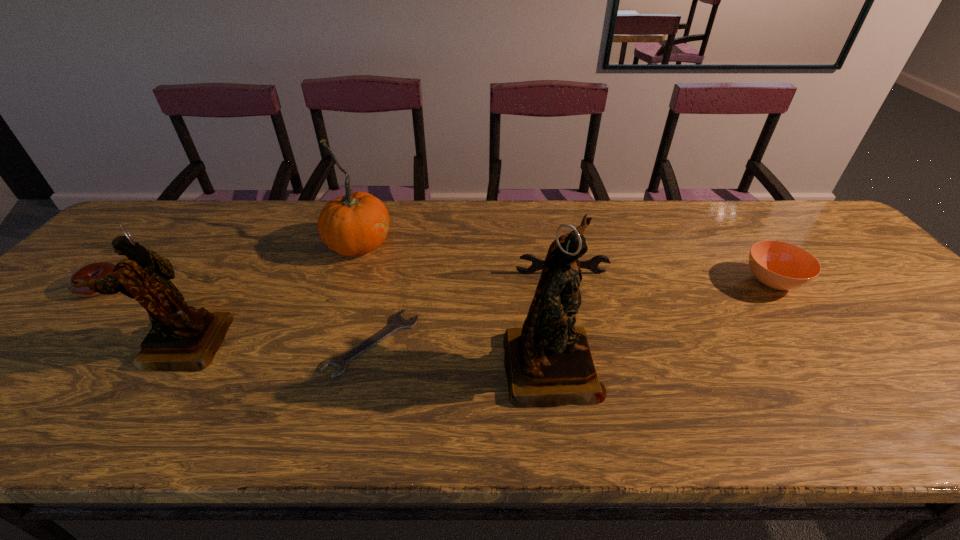
I want to click on doughnut, so pos(100,269).

Where is `the shorter wrench`? the shorter wrench is located at coordinates (398, 323).

You are a GUI agent. You are given a task and a screenshot of the screen. Output one action in this format:
    pyautogui.click(x=<x>, y=<y>)
    Task: Click on the nearer wrench
    
    Given the screenshot: What is the action you would take?
    pyautogui.click(x=398, y=323)

In order to click on blank space located 0.240m on the front-facing side of the second object from left to right in this screenshot , I will do `click(40, 345)`.

Where is `vacant position located on the front-facing side of the second object from left to right`? The width and height of the screenshot is (960, 540). vacant position located on the front-facing side of the second object from left to right is located at coordinates (5, 345).

In order to click on vacant space located on the front-facing side of the second object from left to right in this screenshot , I will do `click(27, 345)`.

Where is `vacant space located 0.060m on the front-facing side of the right figurine`? Image resolution: width=960 pixels, height=540 pixels. vacant space located 0.060m on the front-facing side of the right figurine is located at coordinates (625, 363).

Find the location of a particular element. The image size is (960, 540). vacant space located on the back of the pumpkin is located at coordinates (372, 207).

At what (x,y) coordinates should I click in order to perform the action: click on free space located 0.240m on the left of the rightmost object. Please return your answer as a coordinate pair (x, y). Image resolution: width=960 pixels, height=540 pixels. Looking at the image, I should click on (651, 281).

Find the location of a particular element. The image size is (960, 540). vacant region located 0.260m on the open ends of the taller wrench is located at coordinates (578, 350).